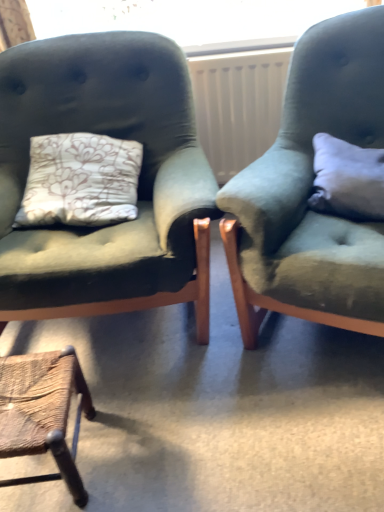
Locate an element on the screen. The width and height of the screenshot is (384, 512). white soft pillow at right is located at coordinates (347, 179).

Find the location of `rustic wood stool at lower left, the third chair in the right-to-left sequence`. rustic wood stool at lower left, the third chair in the right-to-left sequence is located at coordinates tap(43, 412).

Describe the element at coordinates (138, 185) in the screenshot. The height and width of the screenshot is (512, 384). I see `velvet green armchair at left, which is counted as the second chair, starting from the left` at that location.

The height and width of the screenshot is (512, 384). What are the coordinates of `velvet green armchair at left, placed as the second chair when sorted from right to left` in the screenshot? It's located at (138, 185).

Describe the element at coordinates (312, 190) in the screenshot. I see `velvet green armchair at right, marked as the third chair in a left-to-right arrangement` at that location.

This screenshot has height=512, width=384. Find the location of `white soft pillow at right`. white soft pillow at right is located at coordinates (347, 179).

Between white plastic radiator at center and white soft pillow at right, which one has smaller width?

white plastic radiator at center is thinner.

Would you say white soft pillow at right is part of white plastic radiator at center's contents?

No.

Find the location of a particular element. radiator above the white soft pillow at right (from a real-world perspective) is located at coordinates (238, 105).

Would you say velvet green armchair at right, marked as the first chair in a right-to-left arrangement, is inside or outside white soft pillow at right?

velvet green armchair at right, marked as the first chair in a right-to-left arrangement, lies outside white soft pillow at right.

Is point (297, 110) closer or farther from the camera than point (354, 188)?

Point (297, 110) is positioned farther from the camera compared to point (354, 188).

Does velvet green armchair at right, marked as the first chair in a right-to-left arrangement, have a lesser height compared to white soft pillow at right?

In fact, velvet green armchair at right, marked as the first chair in a right-to-left arrangement, may be taller than white soft pillow at right.

Considering the sizes of velvet green armchair at right, marked as the first chair in a right-to-left arrangement, and white plastic radiator at center in the image, is velvet green armchair at right, marked as the first chair in a right-to-left arrangement, taller or shorter than white plastic radiator at center?

Clearly, velvet green armchair at right, marked as the first chair in a right-to-left arrangement, is taller compared to white plastic radiator at center.

Where is `the 1st chair below the white plastic radiator at center (from the image's perspective)`? Image resolution: width=384 pixels, height=512 pixels. the 1st chair below the white plastic radiator at center (from the image's perspective) is located at coordinates (312, 190).

Is the position of velvet green armchair at right, marked as the first chair in a right-to-left arrangement, more distant than that of white plastic radiator at center?

No, velvet green armchair at right, marked as the first chair in a right-to-left arrangement, is closer to the viewer.

Can you tell me how much velvet green armchair at right, marked as the first chair in a right-to-left arrangement, and white plastic radiator at center differ in facing direction?

They differ by 16.9 degrees in their facing directions.

Could you measure the distance between velvet green armchair at left, which is counted as the second chair, starting from the left, and white soft pillow at right?

velvet green armchair at left, which is counted as the second chair, starting from the left, and white soft pillow at right are 22.55 inches apart from each other.

From the image's perspective, which is above, velvet green armchair at left, which is counted as the second chair, starting from the left, or white soft pillow at right?

white soft pillow at right, from the image's perspective.

Does velvet green armchair at left, placed as the second chair when sorted from right to left, come in front of white soft pillow at right?

Yes, it is in front of white soft pillow at right.

Could you tell me if velvet green armchair at left, which is counted as the second chair, starting from the left, is turned towards white soft pillow at right?

No, velvet green armchair at left, which is counted as the second chair, starting from the left, is not aimed at white soft pillow at right.

From the image's perspective, which object appears higher, velvet green armchair at right, marked as the first chair in a right-to-left arrangement, or velvet green armchair at left, placed as the second chair when sorted from right to left?

velvet green armchair at right, marked as the first chair in a right-to-left arrangement, appears higher in the image.

Where is `chair on the right side of velvet green armchair at left, which is counted as the second chair, starting from the left`? This screenshot has width=384, height=512. chair on the right side of velvet green armchair at left, which is counted as the second chair, starting from the left is located at coordinates (312, 190).

Is velvet green armchair at right, marked as the first chair in a right-to-left arrangement, with velvet green armchair at left, placed as the second chair when sorted from right to left?

No, velvet green armchair at right, marked as the first chair in a right-to-left arrangement, is not touching velvet green armchair at left, placed as the second chair when sorted from right to left.

Is velvet green armchair at right, marked as the first chair in a right-to-left arrangement, surrounding velvet green armchair at left, which is counted as the second chair, starting from the left?

No, velvet green armchair at left, which is counted as the second chair, starting from the left, is not a part of velvet green armchair at right, marked as the first chair in a right-to-left arrangement.

Is velvet green armchair at left, placed as the second chair when sorted from right to left, spatially inside velvet green armchair at right, marked as the third chair in a left-to-right arrangement, or outside of it?

velvet green armchair at left, placed as the second chair when sorted from right to left, is located beyond the bounds of velvet green armchair at right, marked as the third chair in a left-to-right arrangement.

Could you tell me if velvet green armchair at left, which is counted as the second chair, starting from the left, is facing velvet green armchair at right, marked as the third chair in a left-to-right arrangement?

No, velvet green armchair at left, which is counted as the second chair, starting from the left, is not turned towards velvet green armchair at right, marked as the third chair in a left-to-right arrangement.

You are a GUI agent. You are given a task and a screenshot of the screen. Output one action in this format:
    pyautogui.click(x=<x>, y=<y>)
    Task: Click on the chair above the velvet green armchair at left, placed as the second chair when sorted from right to left (from the image's perspective)
    
    Given the screenshot: What is the action you would take?
    pyautogui.click(x=312, y=190)

Does rustic wood stool at lower left, the third chair in the right-to-left sequence, lie behind velvet green armchair at left, which is counted as the second chair, starting from the left?

Yes, the depth of rustic wood stool at lower left, the third chair in the right-to-left sequence, is greater than that of velvet green armchair at left, which is counted as the second chair, starting from the left.

Does rustic wood stool at lower left, the 1th chair in the left-to-right sequence, appear on the right side of velvet green armchair at left, placed as the second chair when sorted from right to left?

In fact, rustic wood stool at lower left, the 1th chair in the left-to-right sequence, is to the left of velvet green armchair at left, placed as the second chair when sorted from right to left.

Is rustic wood stool at lower left, the third chair in the right-to-left sequence, turned away from velvet green armchair at left, which is counted as the second chair, starting from the left?

That's right, rustic wood stool at lower left, the third chair in the right-to-left sequence, is facing away from velvet green armchair at left, which is counted as the second chair, starting from the left.

Consider the image. What's the angular difference between rustic wood stool at lower left, the 1th chair in the left-to-right sequence, and velvet green armchair at left, which is counted as the second chair, starting from the left,'s facing directions?

3.77 degrees.

Locate an element on the screen. pillow in front of the white plastic radiator at center is located at coordinates (347, 179).

You are a GUI agent. You are given a task and a screenshot of the screen. Output one action in this format:
    pyautogui.click(x=<x>, y=<y>)
    Task: Click on the chair that is the 1st object located below the white soft pillow at right (from the image's perspective)
    
    Given the screenshot: What is the action you would take?
    pyautogui.click(x=312, y=190)

Based on their spatial positions, is white soft pillow at right or velvet green armchair at right, marked as the third chair in a left-to-right arrangement, further from rustic wood stool at lower left, the third chair in the right-to-left sequence?

Among the two, white soft pillow at right is located further to rustic wood stool at lower left, the third chair in the right-to-left sequence.

From the image, which object appears to be nearer to velvet green armchair at left, which is counted as the second chair, starting from the left, white plastic radiator at center or white soft pillow at right?

The object closer to velvet green armchair at left, which is counted as the second chair, starting from the left, is white plastic radiator at center.

Which object lies further to the anchor point velvet green armchair at left, which is counted as the second chair, starting from the left, rustic wood stool at lower left, the third chair in the right-to-left sequence, or white plastic radiator at center?

white plastic radiator at center lies further to velvet green armchair at left, which is counted as the second chair, starting from the left, than the other object.

Looking at this image, estimate the real-world distances between objects in this image. Which object is closer to velvet green armchair at right, marked as the first chair in a right-to-left arrangement, white soft pillow at right or white plastic radiator at center?

The object closer to velvet green armchair at right, marked as the first chair in a right-to-left arrangement, is white soft pillow at right.

Looking at the image, which one is located closer to white soft pillow at right, white plastic radiator at center or velvet green armchair at left, which is counted as the second chair, starting from the left?

Among the two, velvet green armchair at left, which is counted as the second chair, starting from the left, is located nearer to white soft pillow at right.

When comparing their distances from white soft pillow at right, does velvet green armchair at right, marked as the first chair in a right-to-left arrangement, or velvet green armchair at left, placed as the second chair when sorted from right to left, seem closer?

Based on the image, velvet green armchair at right, marked as the first chair in a right-to-left arrangement, appears to be nearer to white soft pillow at right.

Which object lies further to the anchor point rustic wood stool at lower left, the 1th chair in the left-to-right sequence, velvet green armchair at right, marked as the first chair in a right-to-left arrangement, or velvet green armchair at left, placed as the second chair when sorted from right to left?

velvet green armchair at right, marked as the first chair in a right-to-left arrangement, is positioned further to the anchor rustic wood stool at lower left, the 1th chair in the left-to-right sequence.

Looking at the image, which one is located further to velvet green armchair at left, which is counted as the second chair, starting from the left, white soft pillow at right or rustic wood stool at lower left, the 1th chair in the left-to-right sequence?

The object further to velvet green armchair at left, which is counted as the second chair, starting from the left, is white soft pillow at right.

Where is `chair situated between velvet green armchair at left, which is counted as the second chair, starting from the left, and white soft pillow at right from left to right`? The width and height of the screenshot is (384, 512). chair situated between velvet green armchair at left, which is counted as the second chair, starting from the left, and white soft pillow at right from left to right is located at coordinates (312, 190).

Find the location of a particular element. pillow between white plastic radiator at center and rustic wood stool at lower left, the 1th chair in the left-to-right sequence, in the up-down direction is located at coordinates (347, 179).

Locate an element on the screen. radiator located between velvet green armchair at left, which is counted as the second chair, starting from the left, and white soft pillow at right in the left-right direction is located at coordinates (238, 105).

I want to click on chair between rustic wood stool at lower left, the 1th chair in the left-to-right sequence, and velvet green armchair at right, marked as the third chair in a left-to-right arrangement, from left to right, so click(138, 185).